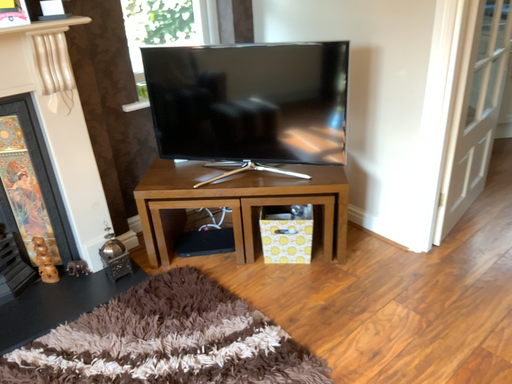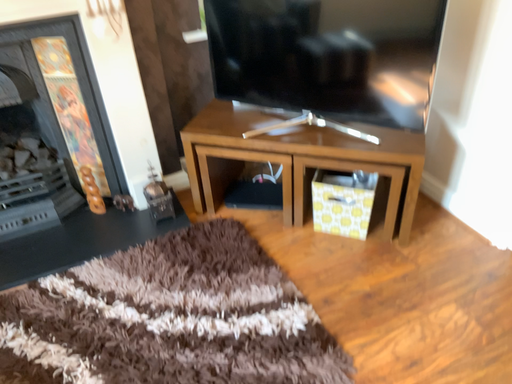
Question: How did the camera likely rotate when shooting the video?

Choices:
 (A) rotated downward
 (B) rotated upward

Answer: (A)